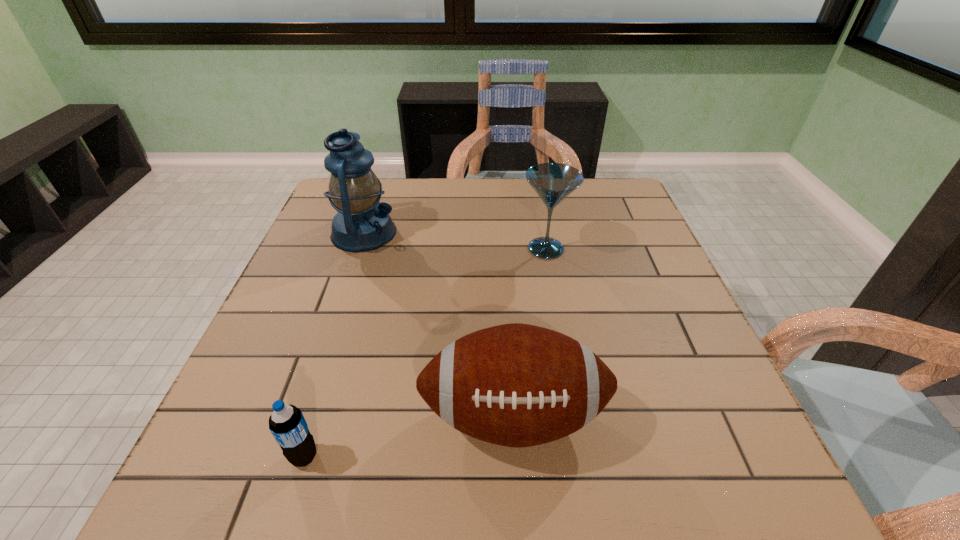
Image resolution: width=960 pixels, height=540 pixels. I want to click on the tallest object, so click(362, 223).

This screenshot has width=960, height=540. I want to click on martini, so click(553, 182).

At what (x,y) coordinates should I click in order to perform the action: click on football. Please return your answer as a coordinate pair (x, y). Looking at the image, I should click on (517, 385).

Locate an element on the screen. the shortest object is located at coordinates (287, 424).

Locate an element on the screen. This screenshot has height=540, width=960. vacant space located on the face of the lantern is located at coordinates click(464, 233).

Image resolution: width=960 pixels, height=540 pixels. Find the location of `vacant space situated 0.280m on the left of the martini`. vacant space situated 0.280m on the left of the martini is located at coordinates (411, 249).

Image resolution: width=960 pixels, height=540 pixels. I want to click on free point located on the back of the soda bottle, so click(x=330, y=374).

Where is `object present at the far edge`? This screenshot has height=540, width=960. object present at the far edge is located at coordinates (362, 223).

What are the coordinates of `football present at the near edge` in the screenshot? It's located at (517, 385).

You are a GUI agent. You are given a task and a screenshot of the screen. Output one action in this format:
    pyautogui.click(x=<x>, y=<y>)
    Task: Click on the soda bottle that is at the near edge
    
    Given the screenshot: What is the action you would take?
    pyautogui.click(x=287, y=424)